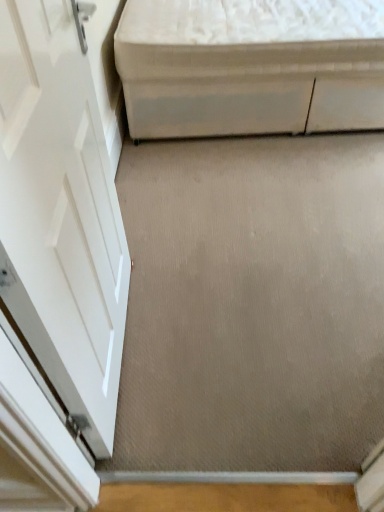
Question: Looking at the image, does beige carpet at center seem bigger or smaller compared to white fabric ottoman at upper right?

Choices:
 (A) big
 (B) small

Answer: (B)

Question: Relative to white fabric ottoman at upper right, is beige carpet at center in front or behind?

Choices:
 (A) behind
 (B) front

Answer: (B)

Question: Is point (218, 433) positioned closer to the camera than point (281, 11)?

Choices:
 (A) closer
 (B) farther

Answer: (A)

Question: In terms of width, does white fabric ottoman at upper right look wider or thinner when compared to beige carpet at center?

Choices:
 (A) wide
 (B) thin

Answer: (A)

Question: Considering the relative positions of white fabric ottoman at upper right and beige carpet at center in the image provided, is white fabric ottoman at upper right to the left or to the right of beige carpet at center?

Choices:
 (A) right
 (B) left

Answer: (A)

Question: Relative to beige carpet at center, is white fabric ottoman at upper right in front or behind?

Choices:
 (A) front
 (B) behind

Answer: (B)

Question: From a real-world perspective, is white fabric ottoman at upper right above or below beige carpet at center?

Choices:
 (A) above
 (B) below

Answer: (A)